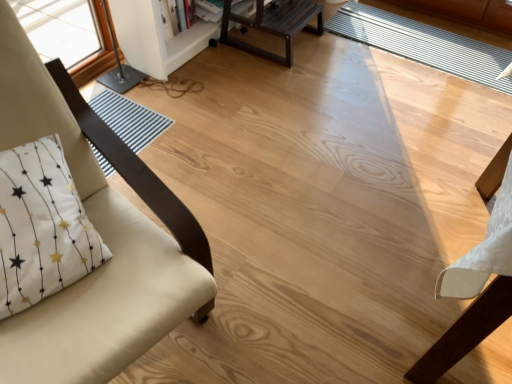
Where is `vacant area that lies between white painted wood bookshelf at upper center and dark brown wood table at upper center`? vacant area that lies between white painted wood bookshelf at upper center and dark brown wood table at upper center is located at coordinates (230, 65).